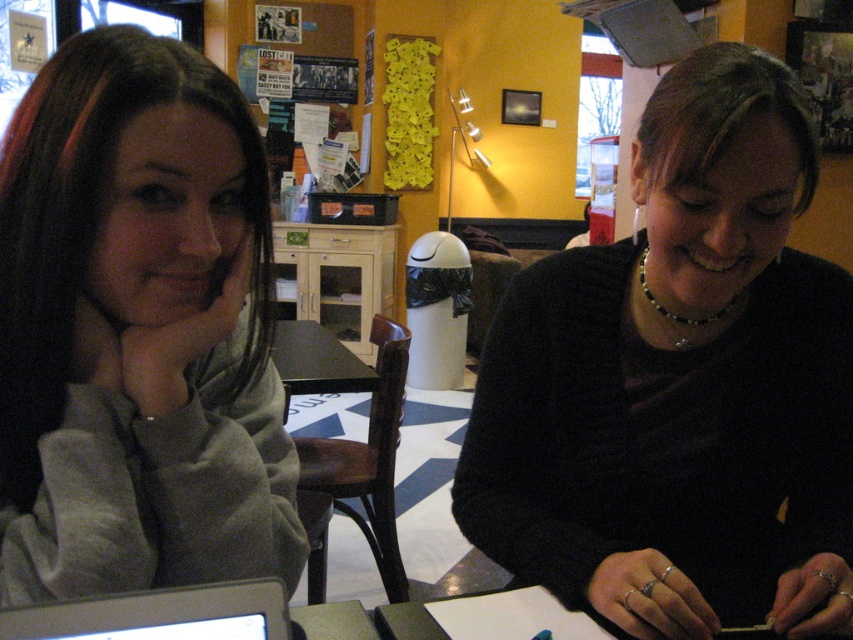
You are trying to place a rectangular box that is 1.2 meters wide on the table between the gray fleece at left and the silver metallic laptop at lower left. Based on their widths, will the box fit horizontally between them?

The gray fleece at left is wider than the silver metallic laptop at lower left. Since the box is 1.2 meters wide, but the combined width of both objects is not provided, it is impossible to determine if the box will fit horizontally between them.

You are a photographer setting up a shoot in this scene. You want to take a photo that clearly shows both the black matte sweater at center and the gray fleece at left. However, your camera can only focus on objects at a certain distance. Which object should you focus on to ensure both are in focus?

You should focus on the gray fleece at left because it is closer to the camera than the black matte sweater at center. By focusing on the closer object, the depth of field may extend to include the farther object as well, ensuring both are in focus.

You are organizing a study session and need to place a notebook between the gray fleece at left and the silver metallic laptop at lower left. Based on their positions, where should you place the notebook?

The gray fleece at left is to the left of the silver metallic laptop at lower left, so you should place the notebook between them to the right of the gray fleece at left and to the left of the silver metallic laptop at lower left.